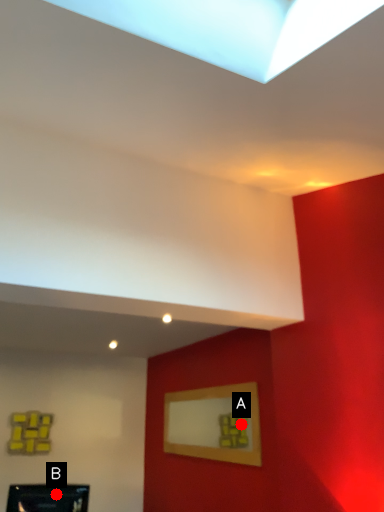
Question: Two points are circled on the image, labeled by A and B beside each circle. Which point appears farthest from the camera in this image?

Choices:
 (A) A is further
 (B) B is further

Answer: (A)